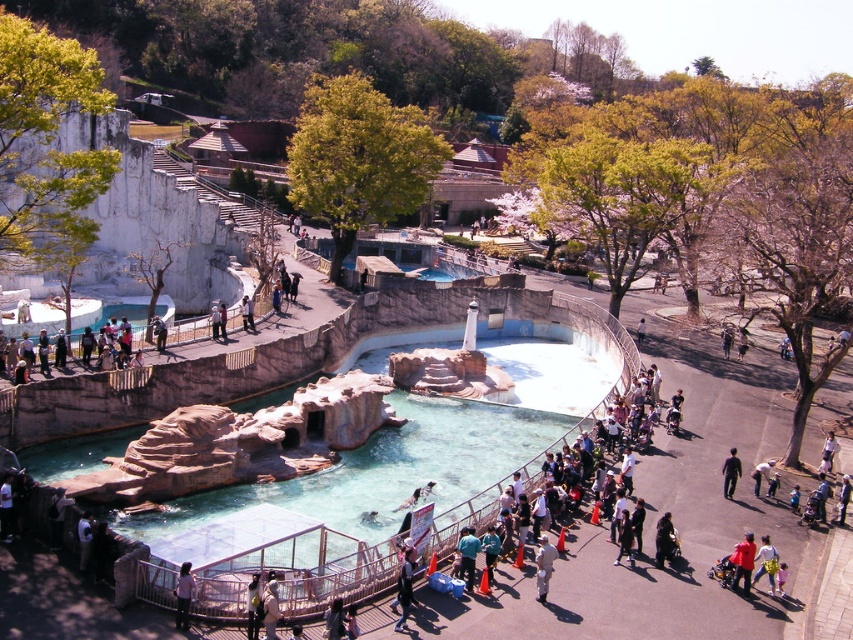
Between dark brown fur at center and black matte pants at lower right, which one appears on the right side from the viewer's perspective?

black matte pants at lower right is more to the right.

At what (x,y) coordinates should I click in order to perform the action: click on dark brown fur at center. Please return your answer as a coordinate pair (x, y). Looking at the image, I should click on (664, 540).

In the scene shown: Who is higher up, light pink fabric pants at lower center or black matte pants at lower right?

black matte pants at lower right

The image size is (853, 640). Describe the element at coordinates (183, 595) in the screenshot. I see `light pink fabric pants at lower center` at that location.

The image size is (853, 640). I want to click on light pink fabric pants at lower center, so click(x=183, y=595).

Does dark blue jeans at center appear over white cotton shirt at center?

Yes, dark blue jeans at center is above white cotton shirt at center.

Image resolution: width=853 pixels, height=640 pixels. What are the coordinates of `dark blue jeans at center` in the screenshot? It's located at (404, 588).

Between point (409, 595) and point (546, 593), which one is positioned behind?

The point (546, 593) is more distant.

Find the location of `dark blue jeans at center`. dark blue jeans at center is located at coordinates (404, 588).